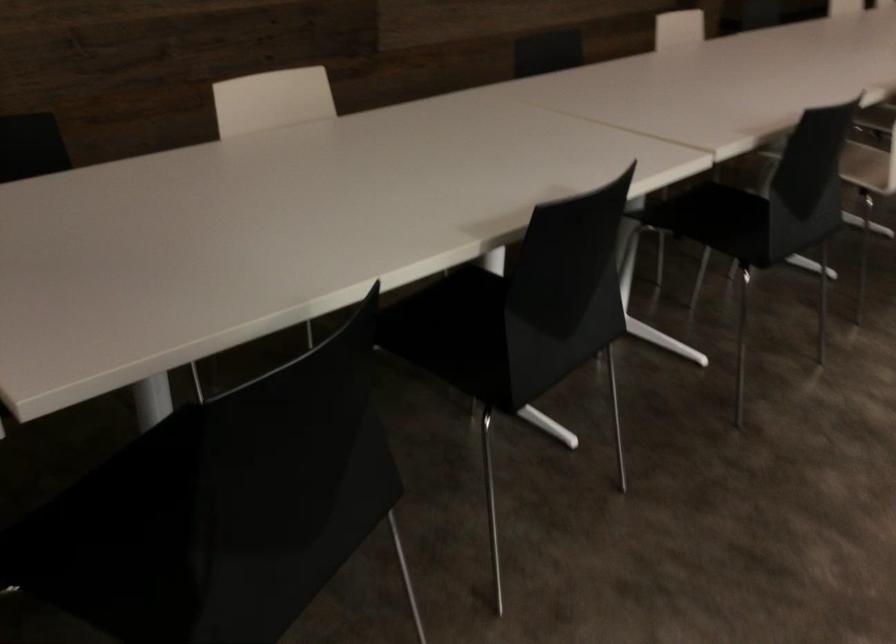
At what (x,y) coordinates should I click in order to perform the action: click on white chair sitting surface. Please return your answer as a coordinate pair (x, y). Image resolution: width=896 pixels, height=644 pixels. Looking at the image, I should click on (867, 167).